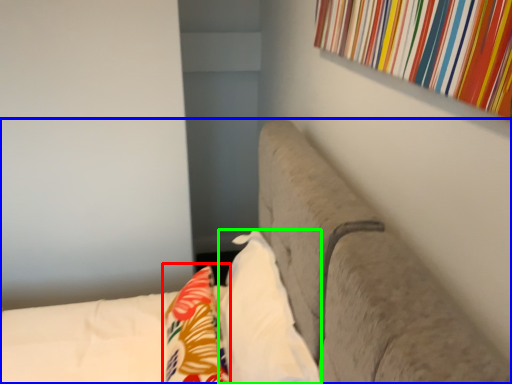
Question: Based on their relative distances, which object is nearer to throw pillow (highlighted by a red box)? Choose from furniture (highlighted by a blue box) and pillow (highlighted by a green box).

Choices:
 (A) furniture
 (B) pillow

Answer: (B)